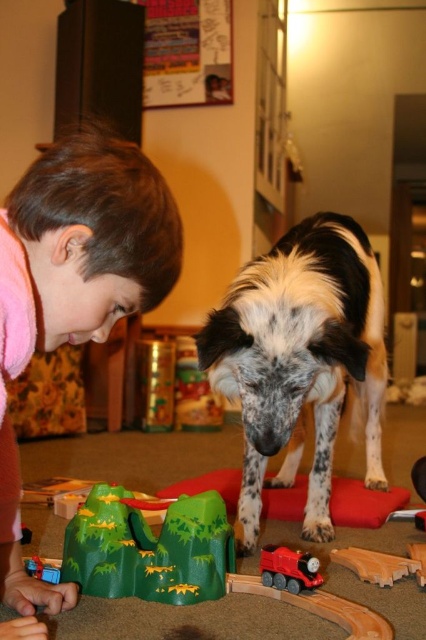
Does spotted fur dog at center have a greater height compared to pink fleece at lower left?

Indeed, spotted fur dog at center has a greater height compared to pink fleece at lower left.

Does spotted fur dog at center have a smaller size compared to pink fleece at lower left?

No, spotted fur dog at center is not smaller than pink fleece at lower left.

Is point (331, 442) positioned after point (103, 308)?

Yes, point (331, 442) is farther from viewer.

This screenshot has width=426, height=640. Identify the location of spotted fur dog at center. (301, 358).

Is point (126, 522) farther from camera compared to point (296, 592)?

Yes, point (126, 522) is behind point (296, 592).

Is green matte mountain at center wider than red plastic train at lower center?

Correct, the width of green matte mountain at center exceeds that of red plastic train at lower center.

This screenshot has width=426, height=640. What do you see at coordinates (198, 564) in the screenshot?
I see `green matte mountain at center` at bounding box center [198, 564].

What are the coordinates of `green matte mountain at center` in the screenshot? It's located at (198, 564).

Between pink fleece at lower left and red plastic train at lower center, which one has more height?

pink fleece at lower left is taller.

Between pink fleece at lower left and red plastic train at lower center, which one is positioned lower?

Positioned lower is red plastic train at lower center.

Who is more distant from viewer, (x=25, y=625) or (x=265, y=579)?

The point (x=265, y=579) is more distant.

Locate an element on the screen. pink fleece at lower left is located at coordinates (86, 243).